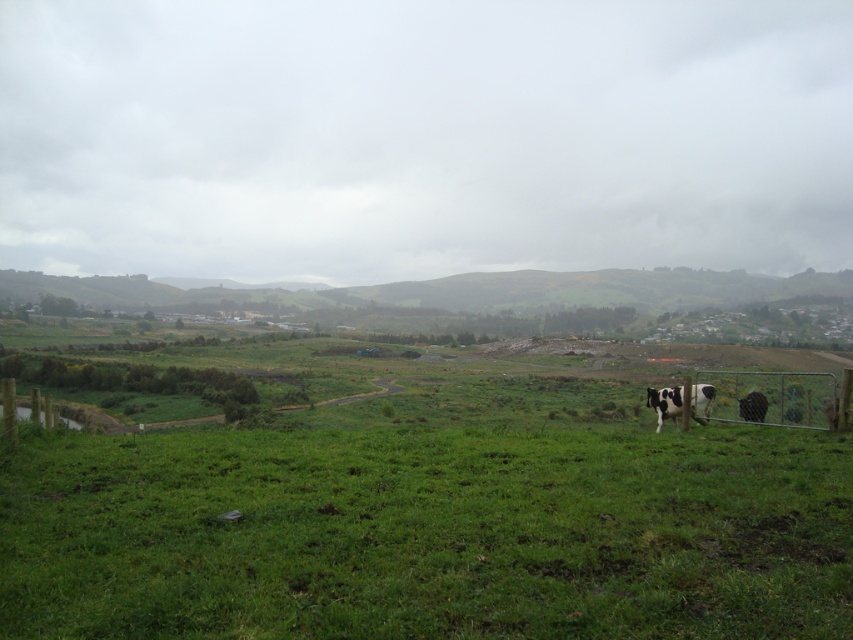
Question: Among these objects, which one is nearest to the camera?

Choices:
 (A) metal chain-link fence at lower right
 (B) black and white spotted cow at right
 (C) black and white spotted cow at lower right

Answer: (A)

Question: Does black and white spotted cow at lower right appear over black and white spotted cow at right?

Choices:
 (A) no
 (B) yes

Answer: (A)

Question: Which of the following is the farthest from the observer?

Choices:
 (A) metal chain-link fence at lower right
 (B) black and white spotted cow at right
 (C) black and white spotted cow at lower right

Answer: (C)

Question: Does metal chain-link fence at lower right have a smaller size compared to black and white spotted cow at lower right?

Choices:
 (A) no
 (B) yes

Answer: (A)

Question: Which of the following is the farthest from the observer?

Choices:
 (A) (759, 394)
 (B) (656, 392)
 (C) (837, 401)

Answer: (B)

Question: Can you confirm if black and white spotted cow at lower right is bigger than black and white spotted cow at right?

Choices:
 (A) no
 (B) yes

Answer: (A)